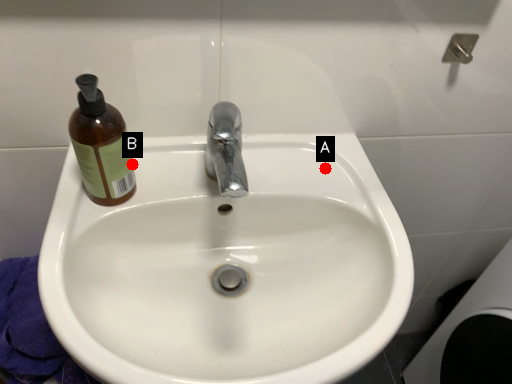
Question: Two points are circled on the image, labeled by A and B beside each circle. Which point is closer to the camera?

Choices:
 (A) A is closer
 (B) B is closer

Answer: (B)